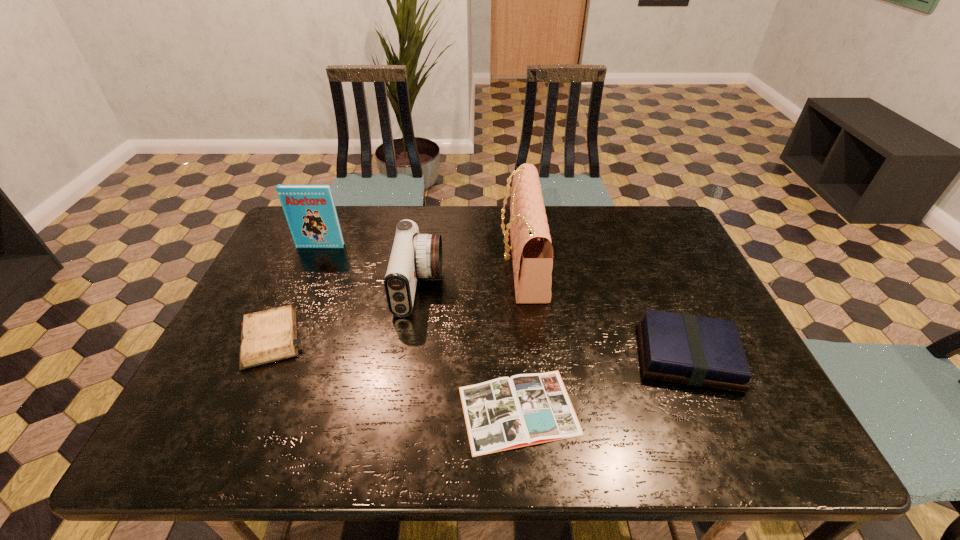
Locate an element on the screen. The width and height of the screenshot is (960, 540). unoccupied area between the handbag and the camcorder is located at coordinates (470, 274).

Identify the location of free spot between the fourth shortest object and the leftmost book. (370, 267).

At what (x,y) coordinates should I click in order to perform the action: click on empty space that is in between the third shortest object and the tallest book. Please return your answer as a coordinate pair (x, y). The image size is (960, 540). Looking at the image, I should click on (504, 301).

Where is `empty space between the camcorder and the handbag`? Image resolution: width=960 pixels, height=540 pixels. empty space between the camcorder and the handbag is located at coordinates (470, 274).

The height and width of the screenshot is (540, 960). Find the location of `free space between the farthest book and the diary`. free space between the farthest book and the diary is located at coordinates tap(296, 292).

Locate an element on the screen. This screenshot has width=960, height=540. empty space between the farthest book and the rightmost object is located at coordinates (504, 301).

Find the location of a particular element. vacant point located between the second shortest object and the shortest object is located at coordinates (395, 374).

What are the coordinates of `free space that is in between the fifth tallest object and the rightmost object` in the screenshot? It's located at (479, 347).

Locate which object is the fourth closest to the farthest book. Please provide its 2D coordinates. Your answer should be formatted as a tuple, i.e. [(x, y)], where the tuple contains the x and y coordinates of a point satisfying the conditions above.

[(505, 413)]

You are a GUI agent. You are given a task and a screenshot of the screen. Output one action in this format:
    pyautogui.click(x=<x>, y=<y>)
    Task: Click on the object identified as the third closest to the leftmost book
    This screenshot has width=960, height=540.
    Given the screenshot: What is the action you would take?
    coord(532,252)